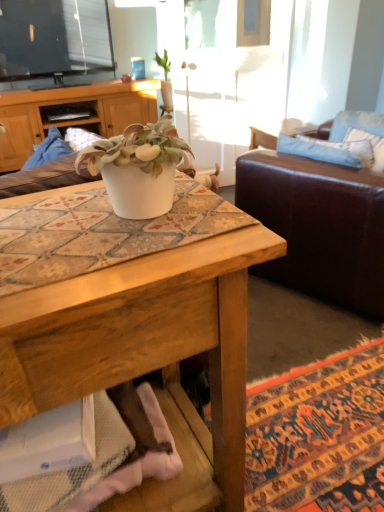
Identify the location of white matte pot at center. (138, 167).

What do you see at coordinates (138, 167) in the screenshot?
I see `white matte pot at center` at bounding box center [138, 167].

The image size is (384, 512). Identify the location of white matte pot at center. (138, 167).